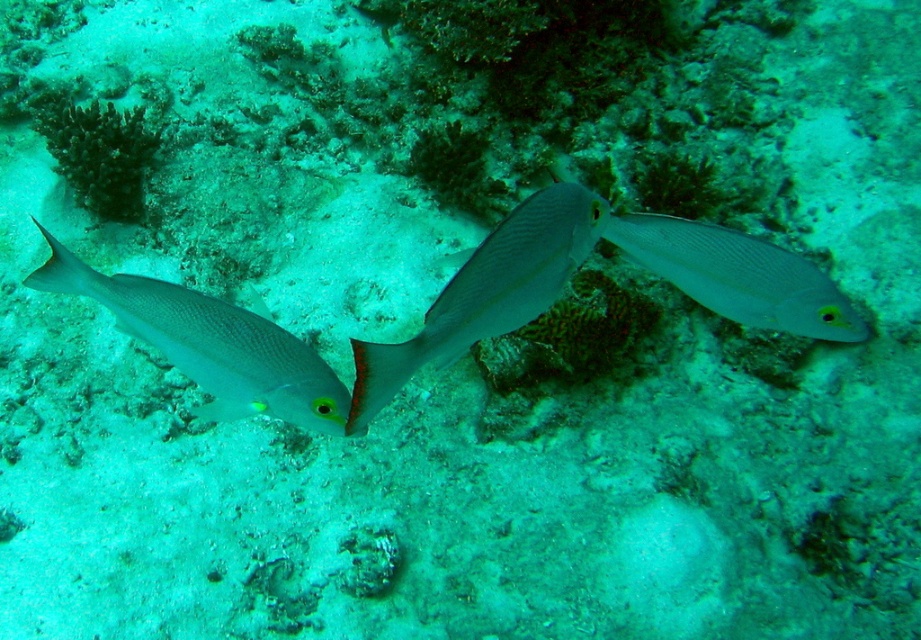
Who is more forward, (150, 292) or (359, 433)?

Point (359, 433) is in front.

Which is behind, point (193, 348) or point (579, 262)?

Point (193, 348)

Locate an element on the screen. silvery smooth fish at left is located at coordinates (210, 344).

Is silvery smooth fish at left closer to camera compared to satin silver fish at center?

Yes.

Who is shorter, silvery smooth fish at left or satin silver fish at center?

satin silver fish at center

Does point (265, 353) come farther from viewer compared to point (679, 221)?

No, it is in front of (679, 221).

Find the location of a particular element. silvery smooth fish at left is located at coordinates (210, 344).

Which is in front, point (462, 284) or point (782, 330)?

Point (462, 284) is more forward.

At what (x,y) coordinates should I click in order to perform the action: click on smooth silver fish at center. Please return your answer as a coordinate pair (x, y). The width and height of the screenshot is (921, 640). Looking at the image, I should click on [x=486, y=292].

Image resolution: width=921 pixels, height=640 pixels. In order to click on smooth silver fish at center in this screenshot , I will do `click(486, 292)`.